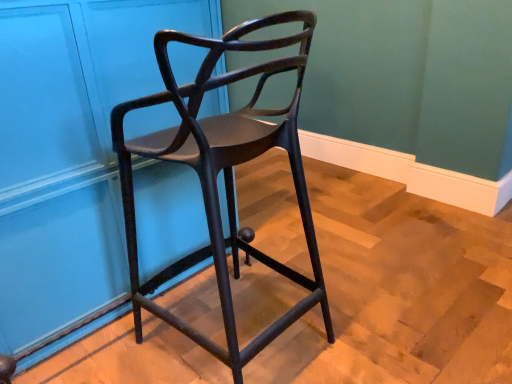
Question: Considering the relative positions of matte black chair at center and matte blue door at upper left in the image provided, is matte black chair at center to the left or to the right of matte blue door at upper left?

Choices:
 (A) right
 (B) left

Answer: (A)

Question: Is matte black chair at center in front of or behind matte blue door at upper left in the image?

Choices:
 (A) front
 (B) behind

Answer: (A)

Question: In terms of size, does matte black chair at center appear bigger or smaller than matte blue door at upper left?

Choices:
 (A) big
 (B) small

Answer: (B)

Question: Is point pos(159,168) closer or farther from the camera than point pos(121,185)?

Choices:
 (A) farther
 (B) closer

Answer: (A)

Question: Is matte blue door at upper left in front of or behind matte black chair at center in the image?

Choices:
 (A) front
 (B) behind

Answer: (B)

Question: Is matte blue door at upper left inside the boundaries of matte black chair at center, or outside?

Choices:
 (A) outside
 (B) inside

Answer: (A)

Question: Considering the positions of matte blue door at upper left and matte black chair at center in the image, is matte blue door at upper left taller or shorter than matte black chair at center?

Choices:
 (A) tall
 (B) short

Answer: (A)